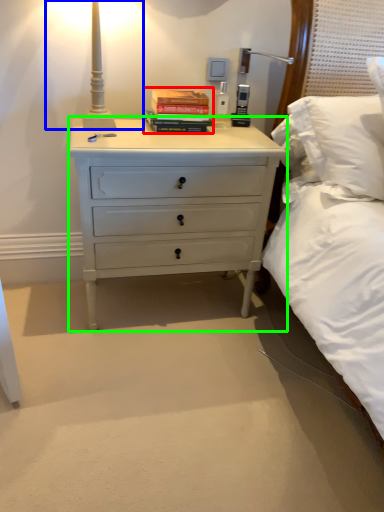
Question: Based on their relative distances, which object is farther from paperback book (highlighted by a red box)? Choose from bedside lamp (highlighted by a blue box) and chest of drawers (highlighted by a green box).

Choices:
 (A) bedside lamp
 (B) chest of drawers

Answer: (B)